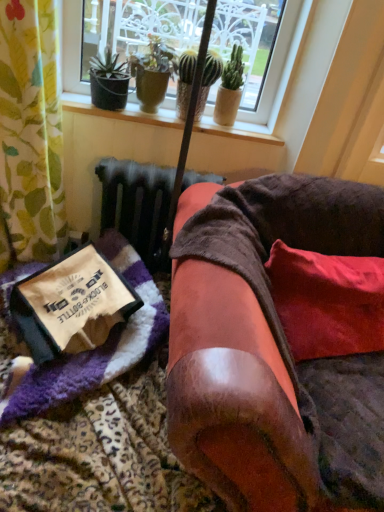
Question: Is green matte cactus at upper center, which is the third houseplant from left to right, in front of or behind purple fuzzy blanket at lower left in the image?

Choices:
 (A) front
 (B) behind

Answer: (B)

Question: Looking at the image, does green matte cactus at upper center, which is the third houseplant from left to right, seem bigger or smaller compared to purple fuzzy blanket at lower left?

Choices:
 (A) big
 (B) small

Answer: (B)

Question: Estimate the real-world distances between objects in this image. Which object is closer to the red velvet pillow at lower right?

Choices:
 (A) purple fuzzy blanket at lower left
 (B) green matte cactus at upper center, which is the 1th houseplant from right to left
 (C) wooden at upper center
 (D) green textured pot at upper center, the third houseplant in the right-to-left sequence
 (E) green textured cactus at upper center, which is the second houseplant in right-to-left order

Answer: (A)

Question: Considering the real-world distances, which object is farthest from the wooden at upper center?

Choices:
 (A) purple fuzzy blanket at lower left
 (B) velvet brown armchair at center
 (C) green matte cactus at upper center, which is the third houseplant from left to right
 (D) green textured pot at upper center, placed as the first houseplant when sorted from left to right
 (E) green textured cactus at upper center, which is the second houseplant in right-to-left order

Answer: (B)